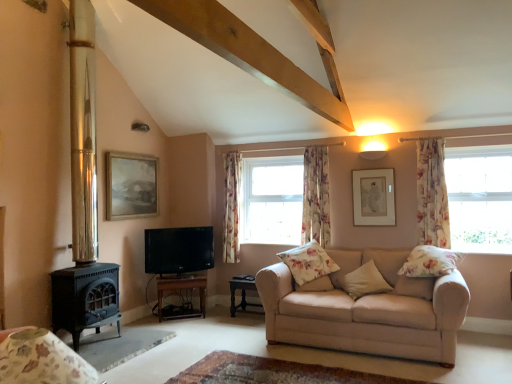
You are a GUI agent. You are given a task and a screenshot of the screen. Output one action in this format:
    pyautogui.click(x=<x>, y=<y>)
    Task: Click on the beige fabric couch at lower right
    
    Given the screenshot: What is the action you would take?
    pyautogui.click(x=368, y=310)

The height and width of the screenshot is (384, 512). Identify the location of floral fabric curtain at center, arranged as the first curtain when viewed from the left. (232, 206).

This screenshot has height=384, width=512. Describe the element at coordinates (232, 206) in the screenshot. I see `floral fabric curtain at center, the first curtain viewed from the back` at that location.

Locate an element on the screen. The image size is (512, 384). transparent glass window at right is located at coordinates (463, 199).

Describe the element at coordinates (429, 262) in the screenshot. This screenshot has height=384, width=512. I see `floral fabric pillow at right, the fourth pillow when ordered from left to right` at that location.

The width and height of the screenshot is (512, 384). Find the location of `black glossy tv at left`. black glossy tv at left is located at coordinates (x=178, y=249).

You are a GUI agent. You are given a task and a screenshot of the screen. Output one action in this format:
    pyautogui.click(x=<x>, y=<y>)
    Task: Click on the dark wood table at lower center, the 2th table from the left
    
    Given the screenshot: What is the action you would take?
    pyautogui.click(x=243, y=293)

Is floral fabric curtain at right, the first curtain viewed from the right, completely or partially outside of floral fabric curtain at center, placed as the second curtain when sorted from left to right?

floral fabric curtain at right, the first curtain viewed from the right, is positioned outside floral fabric curtain at center, placed as the second curtain when sorted from left to right.

Which object is closer to the camera taking this photo, floral fabric curtain at right, the 1th curtain when ordered from front to back, or floral fabric curtain at center, which ranks as the 2th curtain in back-to-front order?

floral fabric curtain at right, the 1th curtain when ordered from front to back, is in front.

Based on their positions, is floral fabric curtain at right, which is the 3th curtain in back-to-front order, located to the left or right of floral fabric curtain at center, which ranks as the 2th curtain in back-to-front order?

floral fabric curtain at right, which is the 3th curtain in back-to-front order, is to the right of floral fabric curtain at center, which ranks as the 2th curtain in back-to-front order.

Image resolution: width=512 pixels, height=384 pixels. Identify the location of curtain above the floral fabric curtain at center, placed as the second curtain when sorted from front to back (from the image's perspective). (432, 194).

Considering the sizes of floral fabric curtain at center, the first curtain viewed from the back, and polished brass fireplace at left in the image, is floral fabric curtain at center, the first curtain viewed from the back, bigger or smaller than polished brass fireplace at left?

In the image, floral fabric curtain at center, the first curtain viewed from the back, appears to be smaller than polished brass fireplace at left.

Can polished brass fireplace at left be found inside floral fabric curtain at center, the first curtain viewed from the back?

No, polished brass fireplace at left is not inside floral fabric curtain at center, the first curtain viewed from the back.

Considering the relative positions of floral fabric curtain at center, positioned as the third curtain in front-to-back order, and polished brass fireplace at left in the image provided, is floral fabric curtain at center, positioned as the third curtain in front-to-back order, in front of polished brass fireplace at left?

No, floral fabric curtain at center, positioned as the third curtain in front-to-back order, is further to the viewer.

Which is in front, floral fabric pillow at right, the first pillow viewed from the right, or floral fabric cushion at center, arranged as the 4th pillow when viewed from the right?

floral fabric pillow at right, the first pillow viewed from the right, is in front.

Does floral fabric pillow at right, the first pillow viewed from the right, turn towards floral fabric cushion at center, acting as the 1th pillow starting from the left?

No, floral fabric pillow at right, the first pillow viewed from the right, is not facing towards floral fabric cushion at center, acting as the 1th pillow starting from the left.

Between floral fabric pillow at right, the first pillow viewed from the right, and floral fabric cushion at center, acting as the 1th pillow starting from the left, which one has smaller width?

floral fabric pillow at right, the first pillow viewed from the right.

Could you measure the distance between floral fabric pillow at right, the first pillow viewed from the right, and floral fabric cushion at center, acting as the 1th pillow starting from the left?

The distance of floral fabric pillow at right, the first pillow viewed from the right, from floral fabric cushion at center, acting as the 1th pillow starting from the left, is 34.42 inches.

Is polished brass fireplace at left positioned with its back to matte white picture frame at upper right, the 2th picture frame in the left-to-right sequence?

No, polished brass fireplace at left is not facing away from matte white picture frame at upper right, the 2th picture frame in the left-to-right sequence.

Which object is further away from the camera taking this photo, polished brass fireplace at left or matte white picture frame at upper right, the 2th picture frame in the left-to-right sequence?

Positioned behind is matte white picture frame at upper right, the 2th picture frame in the left-to-right sequence.

Is polished brass fireplace at left taller or shorter than matte white picture frame at upper right, the 1th picture frame viewed from the right?

Clearly, polished brass fireplace at left is taller compared to matte white picture frame at upper right, the 1th picture frame viewed from the right.

Is polished brass fireplace at left placed right next to matte white picture frame at upper right, the 1th picture frame viewed from the right?

No, polished brass fireplace at left is not making contact with matte white picture frame at upper right, the 1th picture frame viewed from the right.

From a real-world perspective, which object stands above the other?

floral fabric curtain at center, which is counted as the 2th curtain, starting from the right, is physically above.

Is point (326, 202) farther from camera compared to point (298, 273)?

Yes, it is.

Do you think floral fabric curtain at center, which is counted as the 2th curtain, starting from the right, is within floral fabric cushion at center, arranged as the 4th pillow when viewed from the right, or outside of it?

floral fabric curtain at center, which is counted as the 2th curtain, starting from the right, lies outside floral fabric cushion at center, arranged as the 4th pillow when viewed from the right.

Could you tell me if beige fabric couch at lower right is facing floral fabric pillow at center, the third pillow in the right-to-left sequence?

Yes, beige fabric couch at lower right is oriented towards floral fabric pillow at center, the third pillow in the right-to-left sequence.

From the image's perspective, which one is positioned higher, beige fabric couch at lower right or floral fabric pillow at center, the third pillow in the right-to-left sequence?

From the image's view, floral fabric pillow at center, the third pillow in the right-to-left sequence, is above.

Who is more distant, beige fabric couch at lower right or floral fabric pillow at center, acting as the second pillow starting from the left?

floral fabric pillow at center, acting as the second pillow starting from the left, is further away from the camera.

From a real-world perspective, is beige fabric couch at lower right positioned over floral fabric pillow at center, acting as the second pillow starting from the left, based on gravity?

Incorrect, from a real-world perspective, beige fabric couch at lower right is lower than floral fabric pillow at center, acting as the second pillow starting from the left.

From the image's perspective, is wooden tv stand at lower center, arranged as the first table when viewed from the left, located above or below floral fabric curtain at center, which ranks as the 2th curtain in back-to-front order?

wooden tv stand at lower center, arranged as the first table when viewed from the left, is situated lower than floral fabric curtain at center, which ranks as the 2th curtain in back-to-front order, in the image.

What's the angular difference between wooden tv stand at lower center, arranged as the first table when viewed from the left, and floral fabric curtain at center, which ranks as the 2th curtain in back-to-front order,'s facing directions?

There is a 38.7-degree angle between the facing directions of wooden tv stand at lower center, arranged as the first table when viewed from the left, and floral fabric curtain at center, which ranks as the 2th curtain in back-to-front order.

Is wooden tv stand at lower center, arranged as the first table when viewed from the left, in front of or behind floral fabric curtain at center, which is counted as the 2th curtain, starting from the right, in the image?

Clearly, wooden tv stand at lower center, arranged as the first table when viewed from the left, is in front of floral fabric curtain at center, which is counted as the 2th curtain, starting from the right.

Between wooden tv stand at lower center, arranged as the first table when viewed from the left, and floral fabric curtain at center, placed as the second curtain when sorted from front to back, which one has larger size?

wooden tv stand at lower center, arranged as the first table when viewed from the left.

There is a floral fabric curtain at right, which is the 3th curtain in back-to-front order. What are the coordinates of `the 1st curtain below it (from a real-world perspective)` in the screenshot? It's located at (316, 196).

I want to click on the 3rd curtain below the polished brass fireplace at left (from the image's perspective), so click(232, 206).

Considering their positions, is floral fabric cushion at center, acting as the 1th pillow starting from the left, positioned closer to transparent glass window at right than wooden tv stand at lower center, the 2th table in the right-to-left sequence?

floral fabric cushion at center, acting as the 1th pillow starting from the left, is positioned closer to the anchor transparent glass window at right.

Considering their positions, is floral fabric pillow at right, the fourth pillow when ordered from left to right, positioned further to matte white picture frame at upper right, the 2th picture frame in the left-to-right sequence, than floral fabric cushion at center, arranged as the 4th pillow when viewed from the right?

Among the two, floral fabric pillow at right, the fourth pillow when ordered from left to right, is located further to matte white picture frame at upper right, the 2th picture frame in the left-to-right sequence.

Based on their spatial positions, is transparent glass window at right or matte white picture frame at upper right, the 1th picture frame viewed from the right, further from floral fabric pillow at center, acting as the second pillow starting from the left?

transparent glass window at right lies further to floral fabric pillow at center, acting as the second pillow starting from the left, than the other object.

When comparing their distances from floral fabric curtain at right, the first curtain viewed from the right, does floral fabric curtain at center, placed as the second curtain when sorted from front to back, or transparent glass window at right seem further?

floral fabric curtain at center, placed as the second curtain when sorted from front to back, is positioned further to the anchor floral fabric curtain at right, the first curtain viewed from the right.

Estimate the real-world distances between objects in this image. Which object is further from floral fabric pillow at right, the first pillow viewed from the right, beige fabric couch at lower right or matte wooden picture frame at upper left, which ranks as the 1th picture frame in left-to-right order?

matte wooden picture frame at upper left, which ranks as the 1th picture frame in left-to-right order, is positioned further to the anchor floral fabric pillow at right, the first pillow viewed from the right.

Looking at the image, which one is located closer to dark wood table at lower center, placed as the 1th table when sorted from right to left, floral fabric curtain at right, the 1th curtain when ordered from front to back, or floral fabric armchair at lower left?

floral fabric curtain at right, the 1th curtain when ordered from front to back, is closer to dark wood table at lower center, placed as the 1th table when sorted from right to left.

Estimate the real-world distances between objects in this image. Which object is further from beige fabric couch at lower right, transparent glass window at right or black glossy tv at left?

black glossy tv at left is positioned further to the anchor beige fabric couch at lower right.

Looking at this image, estimate the real-world distances between objects in this image. Which object is closer to floral fabric curtain at center, the first curtain viewed from the back, polished brass fireplace at left or matte white picture frame at upper right, the 1th picture frame viewed from the right?

Based on the image, matte white picture frame at upper right, the 1th picture frame viewed from the right, appears to be nearer to floral fabric curtain at center, the first curtain viewed from the back.

Identify the location of curtain between floral fabric armchair at lower left and matte white picture frame at upper right, the 2th picture frame in the left-to-right sequence, from front to back. The image size is (512, 384). (432, 194).

Locate an element on the screen. picture frame between beige fabric pillow at center, the third pillow viewed from the left, and transparent glass window at right is located at coordinates (373, 197).

Find the location of a particular element. The height and width of the screenshot is (384, 512). curtain between black glossy tv at left and floral fabric pillow at center, the third pillow in the right-to-left sequence is located at coordinates (232, 206).

Where is `studio couch between floral fabric armchair at lower left and floral fabric pillow at right, the fourth pillow when ordered from left to right, along the z-axis`? studio couch between floral fabric armchair at lower left and floral fabric pillow at right, the fourth pillow when ordered from left to right, along the z-axis is located at coordinates (368, 310).